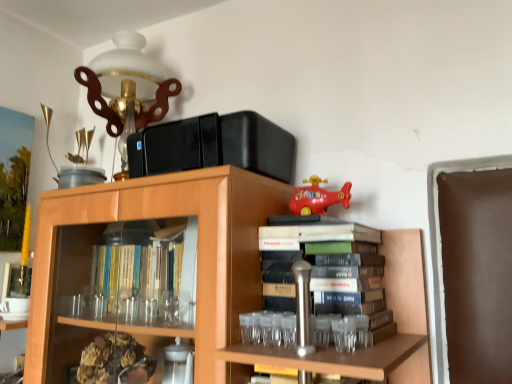
Question: Which is correct: wooden bookcase at upper center is inside matte white glass table lamp at upper left, or outside of it?

Choices:
 (A) outside
 (B) inside

Answer: (A)

Question: Considering the relative positions of wooden bookcase at upper center and matte white glass table lamp at upper left in the image provided, is wooden bookcase at upper center to the left or to the right of matte white glass table lamp at upper left?

Choices:
 (A) left
 (B) right

Answer: (B)

Question: Considering the real-world distances, which object is closest to the wooden bookcase at upper center?

Choices:
 (A) matte white glass table lamp at upper left
 (B) matte plastic toy helicopter at upper right

Answer: (B)

Question: Estimate the real-world distances between objects in this image. Which object is closer to the matte white glass table lamp at upper left?

Choices:
 (A) wooden bookcase at upper center
 (B) matte plastic toy helicopter at upper right

Answer: (A)